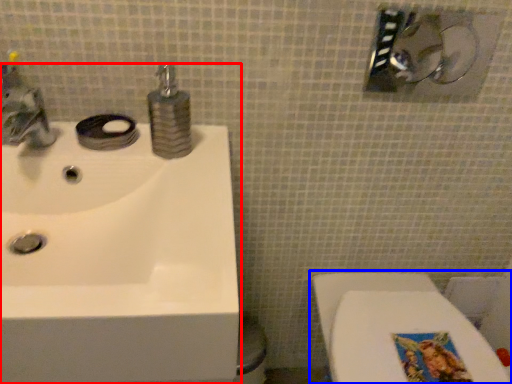
Question: Which object is further to the camera taking this photo, sink (highlighted by a red box) or toilet (highlighted by a blue box)?

Choices:
 (A) sink
 (B) toilet

Answer: (B)